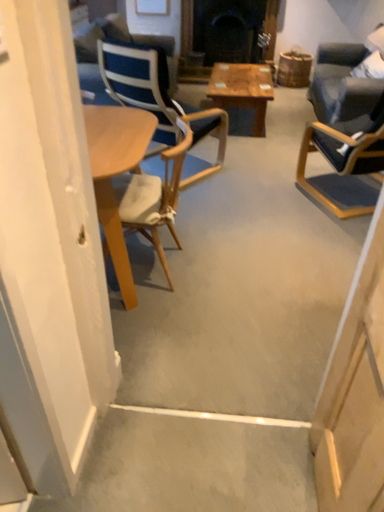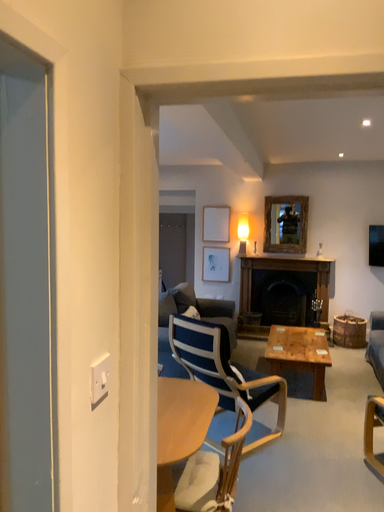
Question: Which way did the camera rotate in the video?

Choices:
 (A) rotated downward
 (B) rotated upward

Answer: (B)